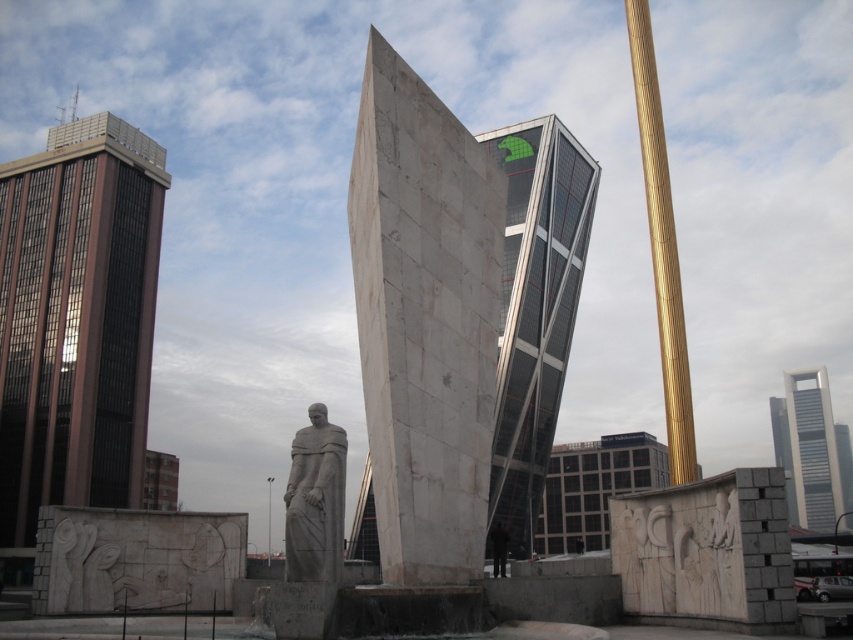
You are a city planner reviewing this urban layout. You need to determine the spatial relationship between the brown glass building at left and the dark gray concrete building at center. Which one is positioned to the left of the other?

The brown glass building at left is to the left of the dark gray concrete building at center.

You are standing at point (76, 320) in the urban scene. What object is located at this coordinate?

The brown glass building at left is located at point (76, 320).

You are a photographer standing in front of the glassy steel skyscraper at center and the gold polished pole at upper right. You want to take a photo that includes both objects in the frame. Which object should you position closer to the center of your camera viewfinder to ensure both are visible without moving your position?

You should position the glassy steel skyscraper at center closer to the center of your camera viewfinder because it is closer to the viewer than the gold polished pole at upper right, so it will appear larger in the frame and require more space to include both objects.